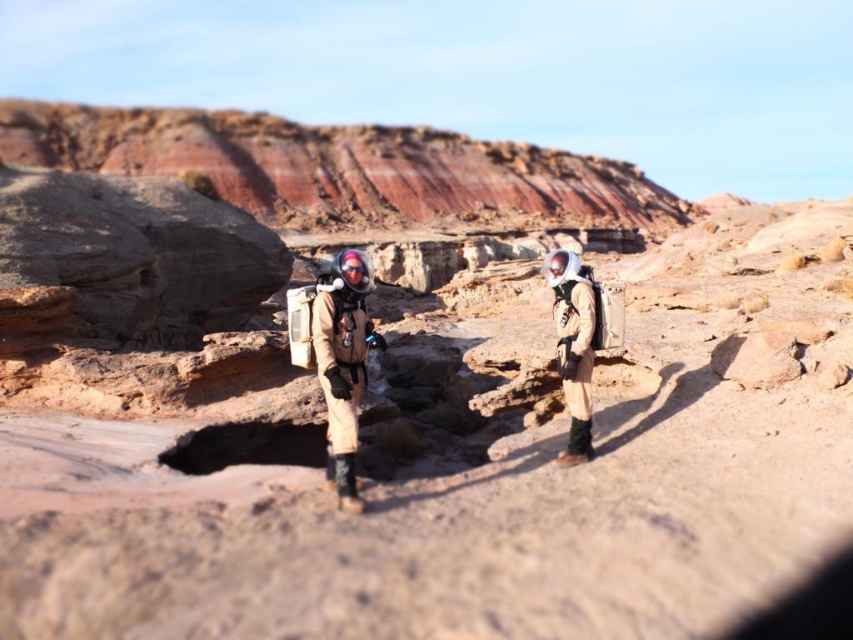
You are an astronaut on a mission to collect samples in this desert environment. You need to reach the sample container located at the base of the nearest cliff. Which spacesuit, the tan fabric spacesuit at center or the matte beige spacesuit at right, is positioned closer to the cliff?

The tan fabric spacesuit at center is positioned closer to the cliff because it is below the matte beige spacesuit at right, indicating it is lower in elevation and nearer to the base of the cliff.

You are a photographer trying to capture both the tan fabric spacesuit at center and the matte beige spacesuit at right in a single frame. Based on their positions and sizes, will you need to adjust your camera angle to ensure both are fully visible?

The tan fabric spacesuit at center might be wider than matte beige spacesuit at right, so you may need to adjust your camera angle to ensure both are fully visible depending on their actual widths.

You are a drone operator controlling a drone with a 1.2 meter wingspan. You need to fly the drone through the space between the two individuals in the image. The point at coordinates point (341, 364) marks the center of the tan fabric spacesuit. Can the drone safely pass between them without hitting either suit?

The point at (341, 364) marks the center of the tan fabric spacesuit at center. Since the drone has a wingspan of 1.2 meters, it can safely pass between the two individuals as long as there is sufficient space between them. However, without specific distance information between the two individuals, it is impossible to determine if the 1.2 meter wingspan will fit. The answer requires knowing the exact distance between the two spacesuits.